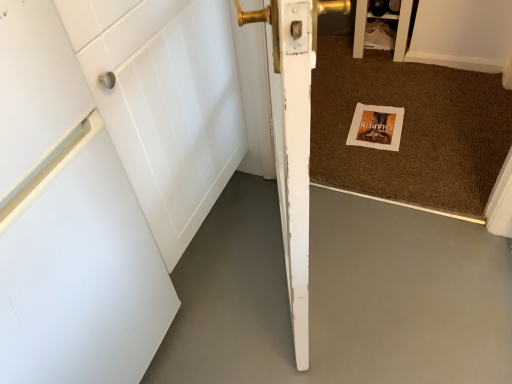
What do you see at coordinates (401, 28) in the screenshot?
I see `matte white cabinet at upper right` at bounding box center [401, 28].

Where is `gold metallic door handle at upper center`? This screenshot has width=512, height=384. gold metallic door handle at upper center is located at coordinates (331, 19).

In order to face white matte concrete at lower left, should I rotate leftwards or rightwards?

Turn right approximately 0.715 degrees to face it.

This screenshot has width=512, height=384. I want to click on white matte concrete at lower left, so 339,296.

Identify the location of white paper postcard at center. (376, 127).

I want to click on matte white cabinet at upper right, so click(401, 28).

Measure the distance between gold metallic door handle at upper center and matte white cabinet at upper right.

They are 8.07 inches apart.

From a real-world perspective, relative to matte white cabinet at upper right, is gold metallic door handle at upper center vertically above or below?

gold metallic door handle at upper center is situated lower than matte white cabinet at upper right in the real world.

From the image's perspective, relative to matte white cabinet at upper right, is gold metallic door handle at upper center above or below?

Based on their image positions, gold metallic door handle at upper center is located above matte white cabinet at upper right.

Is white matte concrete at lower left aimed at brown woven mat at center?

Yes.

In the image, there is a brown woven mat at center. Identify the location of concrete below it (from the image's perspective). (339, 296).

Is white matte concrete at lower left far away from brown woven mat at center?

white matte concrete at lower left is actually quite close to brown woven mat at center.

Considering the positions of objects white matte door at center and brown woven mat at center in the image provided, who is behind, white matte door at center or brown woven mat at center?

brown woven mat at center.

Is brown woven mat at center at the back of white matte door at center?

white matte door at center is not turned away from brown woven mat at center.

Considering the relative sizes of white matte door at center and brown woven mat at center in the image provided, is white matte door at center bigger than brown woven mat at center?

Indeed, white matte door at center has a larger size compared to brown woven mat at center.

Looking at their sizes, would you say white matte door at center is wider or thinner than brown woven mat at center?

Considering their sizes, white matte door at center looks slimmer than brown woven mat at center.

Is brown woven mat at center inside or outside of white matte door at center?

brown woven mat at center exists outside the volume of white matte door at center.

Considering the sizes of objects brown woven mat at center and white matte door at center in the image provided, who is thinner, brown woven mat at center or white matte door at center?

white matte door at center is thinner.

From the image's perspective, which is below, brown woven mat at center or white matte door at center?

white matte door at center appears lower in the image.

Is white matte concrete at lower left turned away from white paper postcard at center?

No.

How much distance is there between white matte concrete at lower left and white paper postcard at center?

white matte concrete at lower left is 24.62 inches away from white paper postcard at center.

Is white matte concrete at lower left not inside white paper postcard at center?

Yes, white matte concrete at lower left is located beyond the bounds of white paper postcard at center.

From a real-world perspective, is white matte concrete at lower left above or below white paper postcard at center?

white matte concrete at lower left is situated lower than white paper postcard at center in the real world.

Is brown woven mat at center positioned in front of gold metallic door handle at upper center?

Yes, it is in front of gold metallic door handle at upper center.

Where is `door handle that is behind the brown woven mat at center`? door handle that is behind the brown woven mat at center is located at coordinates (331, 19).

In the scene shown: Between brown woven mat at center and gold metallic door handle at upper center, which one has smaller width?

gold metallic door handle at upper center is thinner.

Is brown woven mat at center placed right next to gold metallic door handle at upper center?

No, brown woven mat at center is not making contact with gold metallic door handle at upper center.

Consider the image. Which point is more forward, (x=346, y=176) or (x=454, y=293)?

The point (x=454, y=293) is more forward.

Is brown woven mat at center inside the boundaries of white matte concrete at lower left, or outside?

The correct answer is: outside.

Is brown woven mat at center smaller than white matte concrete at lower left?

Actually, brown woven mat at center might be larger than white matte concrete at lower left.

Locate an element on the screen. This screenshot has width=512, height=384. cabinetry above the gold metallic door handle at upper center (from a real-world perspective) is located at coordinates (401, 28).

Where is `concrete located below the brown woven mat at center (from the image's perspective)`? concrete located below the brown woven mat at center (from the image's perspective) is located at coordinates (339, 296).

From the image, which object appears to be farther from white paper postcard at center, white matte concrete at lower left or brown woven mat at center?

Based on the image, white matte concrete at lower left appears to be further to white paper postcard at center.

When comparing their distances from white paper postcard at center, does brown woven mat at center or matte white cabinet at upper right seem further?

matte white cabinet at upper right is further to white paper postcard at center.

Estimate the real-world distances between objects in this image. Which object is closer to matte white cabinet at upper right, white matte concrete at lower left or gold metallic door handle at upper center?

Among the two, gold metallic door handle at upper center is located nearer to matte white cabinet at upper right.

When comparing their distances from brown woven mat at center, does matte white cabinet at upper right or white paper postcard at center seem closer?

Among the two, white paper postcard at center is located nearer to brown woven mat at center.

Looking at the image, which one is located further to brown woven mat at center, white paper postcard at center or white matte door at center?

The object further to brown woven mat at center is white matte door at center.

Based on their spatial positions, is brown woven mat at center or white matte concrete at lower left closer to matte white cabinet at upper right?

The object closer to matte white cabinet at upper right is brown woven mat at center.

Looking at the image, which one is located further to white paper postcard at center, brown woven mat at center or gold metallic door handle at upper center?

gold metallic door handle at upper center is positioned further to the anchor white paper postcard at center.

Based on the photo, which object lies nearer to the anchor point matte white cabinet at upper right, brown woven mat at center or white matte door at center?

Among the two, brown woven mat at center is located nearer to matte white cabinet at upper right.

Identify the location of cabinetry between gold metallic door handle at upper center and white paper postcard at center vertically. (401, 28).

You are a GUI agent. You are given a task and a screenshot of the screen. Output one action in this format:
    pyautogui.click(x=<x>, y=<y>)
    Task: Click on the postcard positioned between white matte door at center and gold metallic door handle at upper center from near to far
    The image size is (512, 384).
    Given the screenshot: What is the action you would take?
    pos(376,127)

Where is `postcard that lies between matte white cabinet at upper right and white matte concrete at lower left from top to bottom`? postcard that lies between matte white cabinet at upper right and white matte concrete at lower left from top to bottom is located at coordinates pyautogui.click(x=376, y=127).

Image resolution: width=512 pixels, height=384 pixels. I want to click on doormat between gold metallic door handle at upper center and white matte concrete at lower left in the vertical direction, so coord(410,129).